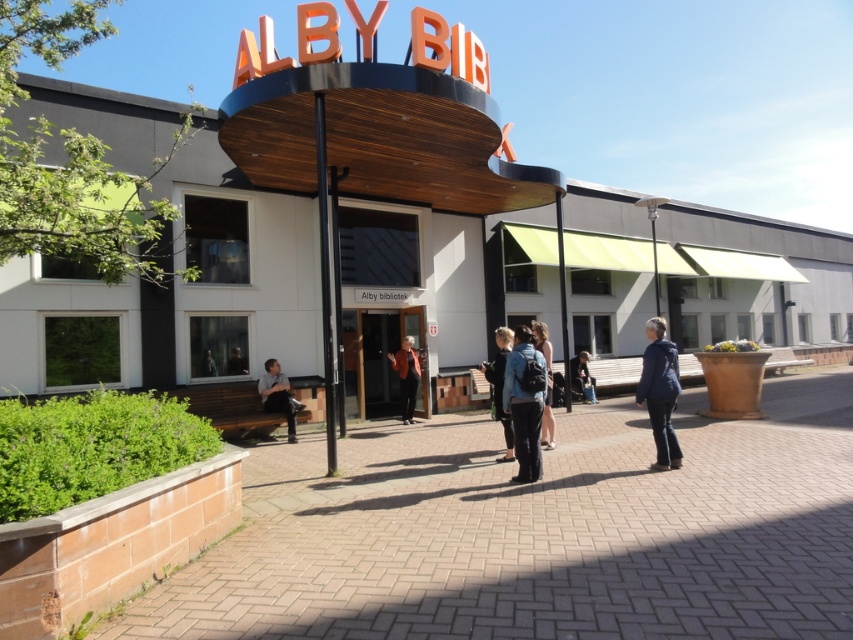
Looking at this image, you are standing at the entrance of the ALBY BIB library and see an orange leather jacket at center and dark blue jeans at lower center. Which object is closer to you?

The orange leather jacket at center is closer to you because it is in front of the dark blue jeans at lower center.

You are a photographer trying to capture both the dark blue jeans at center and the dark blue jeans at lower center in a single frame. Considering their sizes, which pair of dark blue jeans will appear closer to the camera in the photo?

The dark blue jeans at center will appear closer to the camera because it has a larger size compared to the dark blue jeans at lower center, which is smaller and likely farther away.

You are standing at the entrance of ALBY BIB and see two people wearing dark blue jeans at center and dark blue jeans at lower center. Which person is closer to you?

The dark blue jeans at center is closer to you because it is in front of the dark blue jeans at lower center.